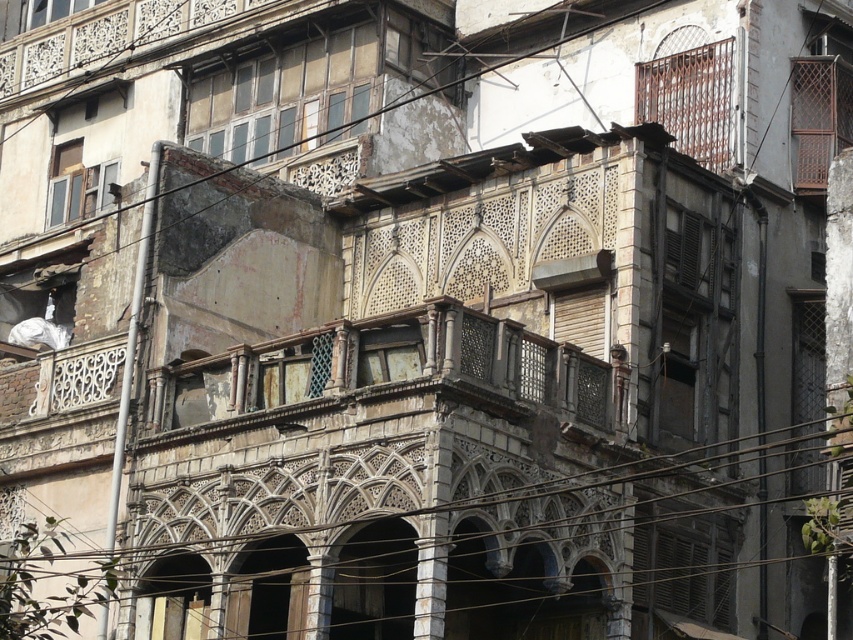
Question: Can you confirm if metallic wire at upper center is positioned below rusty metal balcony at center?

Choices:
 (A) yes
 (B) no

Answer: (B)

Question: Can you confirm if metallic wire at upper center is positioned above rusty metal balcony at center?

Choices:
 (A) yes
 (B) no

Answer: (A)

Question: Which point is farther to the camera?

Choices:
 (A) (454, 344)
 (B) (189, 209)

Answer: (B)

Question: Does metallic wire at upper center appear under rusty metal balcony at center?

Choices:
 (A) no
 (B) yes

Answer: (A)